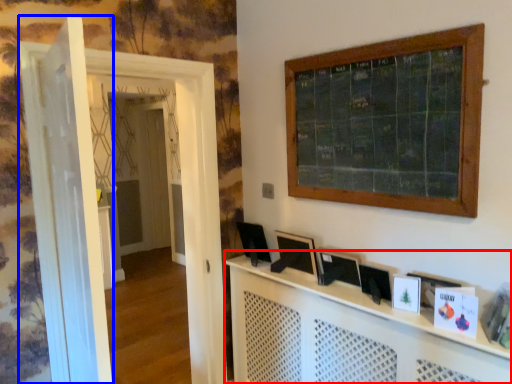
Question: Which point is further to the camera, computer desk (highlighted by a red box) or door (highlighted by a blue box)?

Choices:
 (A) computer desk
 (B) door

Answer: (A)